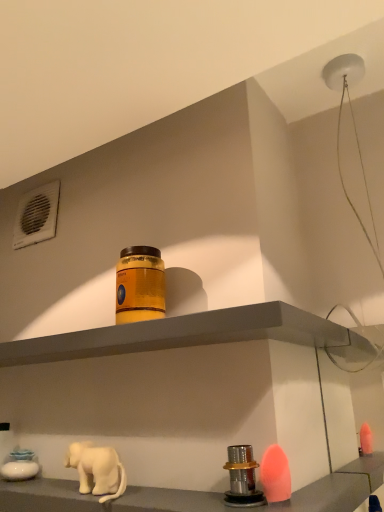
Question: Is orange matte jar at center touching white matte elephant at lower left?

Choices:
 (A) no
 (B) yes

Answer: (A)

Question: Does orange matte jar at center have a greater height compared to white matte elephant at lower left?

Choices:
 (A) yes
 (B) no

Answer: (A)

Question: From the image's perspective, does orange matte jar at center appear lower than white matte elephant at lower left?

Choices:
 (A) no
 (B) yes

Answer: (A)

Question: Is orange matte jar at center smaller than white matte elephant at lower left?

Choices:
 (A) no
 (B) yes

Answer: (A)

Question: Does orange matte jar at center turn towards white matte elephant at lower left?

Choices:
 (A) yes
 (B) no

Answer: (B)

Question: From a real-world perspective, does orange matte jar at center sit lower than white matte elephant at lower left?

Choices:
 (A) yes
 (B) no

Answer: (B)

Question: Is matte gray shelf at center, acting as the second shelf starting from the bottom, at the left side of orange matte jar at center?

Choices:
 (A) yes
 (B) no

Answer: (A)

Question: Is matte gray shelf at center, the 1th shelf when ordered from top to bottom, oriented away from orange matte jar at center?

Choices:
 (A) no
 (B) yes

Answer: (A)

Question: Can you confirm if matte gray shelf at center, the 1th shelf when ordered from top to bottom, is taller than orange matte jar at center?

Choices:
 (A) yes
 (B) no

Answer: (B)

Question: Is orange matte jar at center surrounded by matte gray shelf at center, the 1th shelf when ordered from top to bottom?

Choices:
 (A) yes
 (B) no

Answer: (B)

Question: Is matte gray shelf at center, the 1th shelf when ordered from top to bottom, not within orange matte jar at center?

Choices:
 (A) no
 (B) yes

Answer: (B)

Question: Can you confirm if matte gray shelf at center, the 1th shelf when ordered from top to bottom, is positioned to the right of orange matte jar at center?

Choices:
 (A) no
 (B) yes

Answer: (A)

Question: Is metallic silver knob at lower center, which appears as the first shelf when ordered from the bottom, positioned in front of white matte elephant at lower left?

Choices:
 (A) yes
 (B) no

Answer: (A)